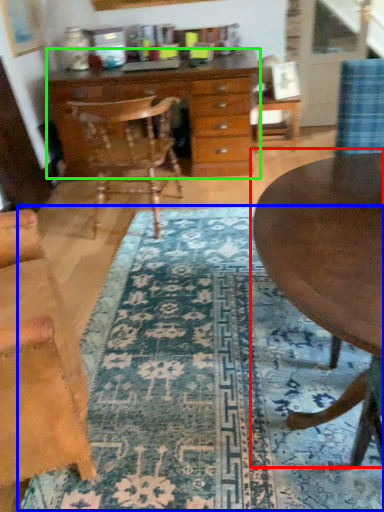
Question: Which object is positioned farthest from coffee table (highlighted by a red box)? Select from mat (highlighted by a blue box) and chest of drawers (highlighted by a green box).

Choices:
 (A) mat
 (B) chest of drawers

Answer: (B)